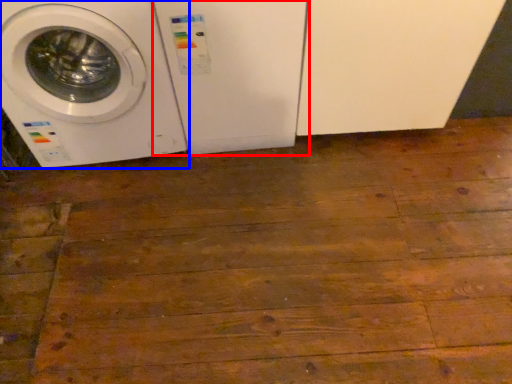
Question: Which object is closer to the camera taking this photo, washing machine (highlighted by a red box) or washing machine (highlighted by a blue box)?

Choices:
 (A) washing machine
 (B) washing machine

Answer: (B)